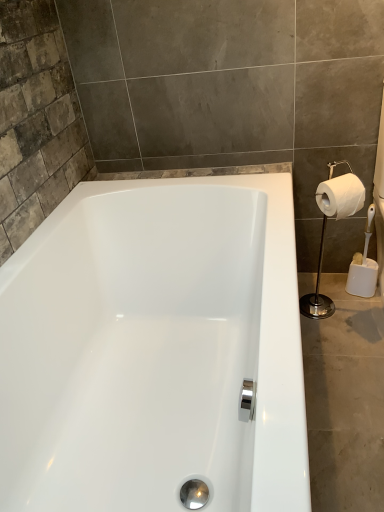
Question: In terms of size, does white glossy toilet paper holder at right appear bigger or smaller than white matte toilet paper at right?

Choices:
 (A) big
 (B) small

Answer: (A)

Question: In terms of height, does white glossy toilet paper holder at right look taller or shorter compared to white matte toilet paper at right?

Choices:
 (A) short
 (B) tall

Answer: (B)

Question: From a real-world perspective, relative to white matte toilet paper at right, is white glossy toilet paper holder at right vertically above or below?

Choices:
 (A) below
 (B) above

Answer: (A)

Question: Is white matte toilet paper at right to the left or to the right of white glossy toilet paper holder at right in the image?

Choices:
 (A) left
 (B) right

Answer: (B)

Question: Is white matte toilet paper at right inside or outside of white glossy toilet paper holder at right?

Choices:
 (A) inside
 (B) outside

Answer: (A)

Question: Based on their sizes in the image, would you say white matte toilet paper at right is bigger or smaller than white glossy toilet paper holder at right?

Choices:
 (A) small
 (B) big

Answer: (A)

Question: From a real-world perspective, is white matte toilet paper at right above or below white glossy toilet paper holder at right?

Choices:
 (A) above
 (B) below

Answer: (A)